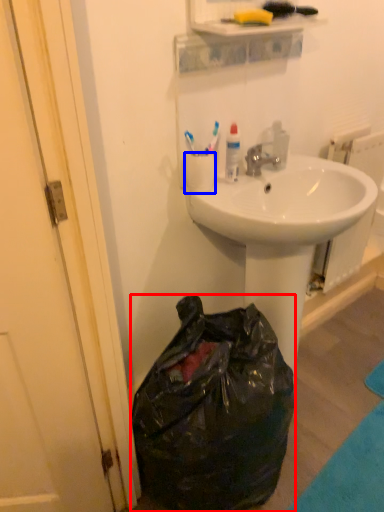
Question: Which of the following is the closest to the observer, trash bin/can (highlighted by a red box) or coffee cup (highlighted by a blue box)?

Choices:
 (A) trash bin/can
 (B) coffee cup

Answer: (A)